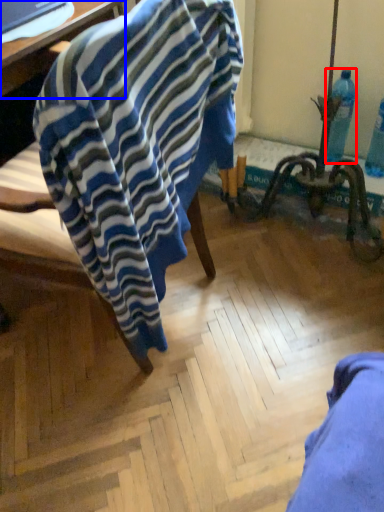
Question: Which object is closer to the camera taking this photo, bottle (highlighted by a red box) or table (highlighted by a blue box)?

Choices:
 (A) bottle
 (B) table

Answer: (B)